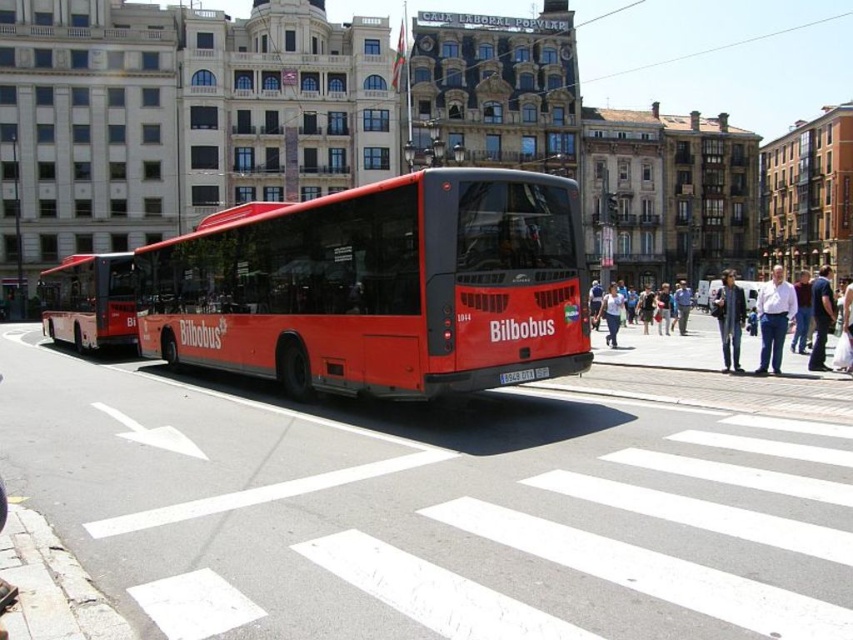
Is matte red bus at left below light blue jeans at center?

Yes, matte red bus at left is below light blue jeans at center.

What do you see at coordinates (90, 301) in the screenshot? I see `matte red bus at left` at bounding box center [90, 301].

You are a GUI agent. You are given a task and a screenshot of the screen. Output one action in this format:
    pyautogui.click(x=<x>, y=<y>)
    Task: Click on the matte red bus at left
    The width and height of the screenshot is (853, 640).
    Given the screenshot: What is the action you would take?
    pyautogui.click(x=90, y=301)

Between matte red bus at center and denim jacket at center, which one has more height?

With more height is matte red bus at center.

Who is positioned more to the left, matte red bus at center or denim jacket at center?

matte red bus at center

Who is more distant from viewer, (x=231, y=356) or (x=734, y=321)?

Point (x=231, y=356)

You are a GUI agent. You are given a task and a screenshot of the screen. Output one action in this format:
    pyautogui.click(x=<x>, y=<y>)
    Task: Click on the matte red bus at center
    The width and height of the screenshot is (853, 640).
    Given the screenshot: What is the action you would take?
    pyautogui.click(x=378, y=285)

Between matte black people at center and denim jacket at center, which one appears on the left side from the viewer's perspective?

matte black people at center is more to the left.

Is matte black people at center wider than denim jacket at center?

No, matte black people at center is not wider than denim jacket at center.

Does point (596, 346) come in front of point (735, 365)?

No, it is not.

Where is `matte black people at center`? matte black people at center is located at coordinates (665, 346).